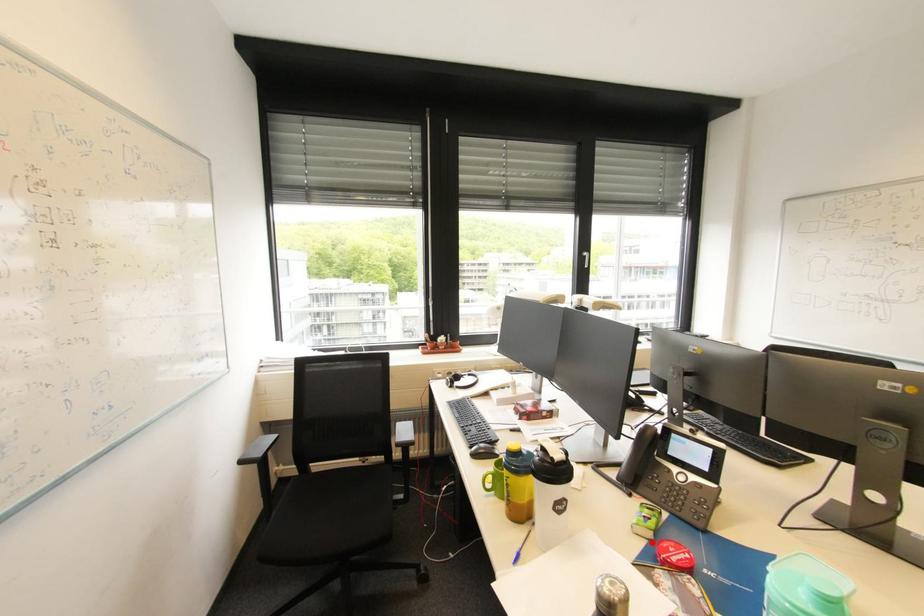
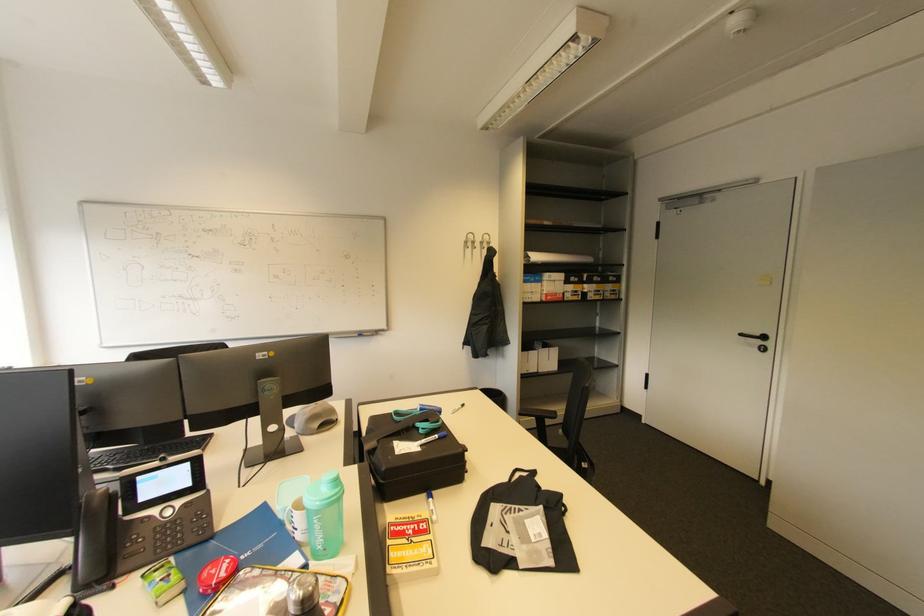
Question: I am providing you with two images of the same scene from different viewpoints. Given a red point in image1, look at the same physical point in image2. Is it:

Choices:
 (A) Closer to the viewpoint
 (B) Farther from the viewpoint

Answer: (B)